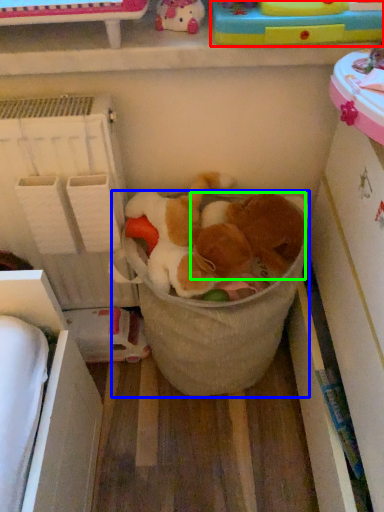
Question: Which object is positioned farthest from toy (highlighted by a red box)? Select from laundry basket (highlighted by a blue box) and animal (highlighted by a green box).

Choices:
 (A) laundry basket
 (B) animal

Answer: (A)